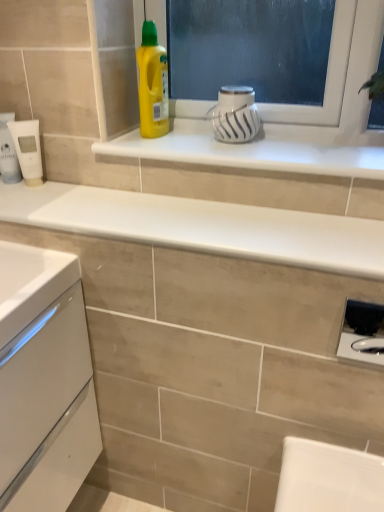
This screenshot has height=512, width=384. Find the location of `vacant area that lies in front of white matte tube at left, the 2th appliance when ordered from top to bottom`. vacant area that lies in front of white matte tube at left, the 2th appliance when ordered from top to bottom is located at coordinates (33, 202).